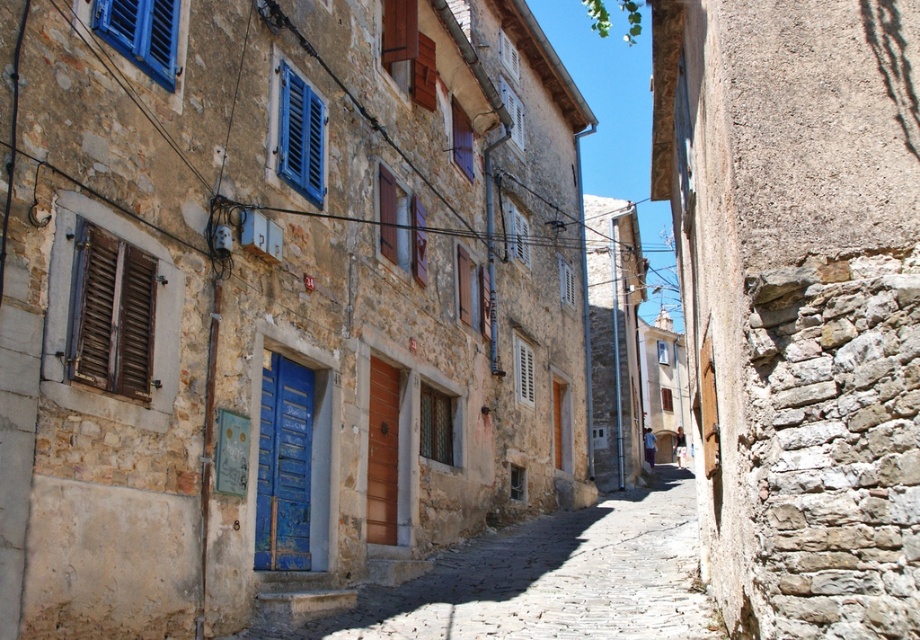
You are standing at point (283, 465) in the cobblestone street. What is the object directly in front of you?

The blue wooden door at center is directly in front of you at point (283, 465).

You are a painter who needs to decide which object to paint first. The blue wooden door at center and the white wooden shutter at center are both in need of a fresh coat. Considering their sizes, which one should you tackle first if you want to start with the larger object?

The blue wooden door at center has a larger size compared to the white wooden shutter at center, so you should paint the blue wooden door at center first.